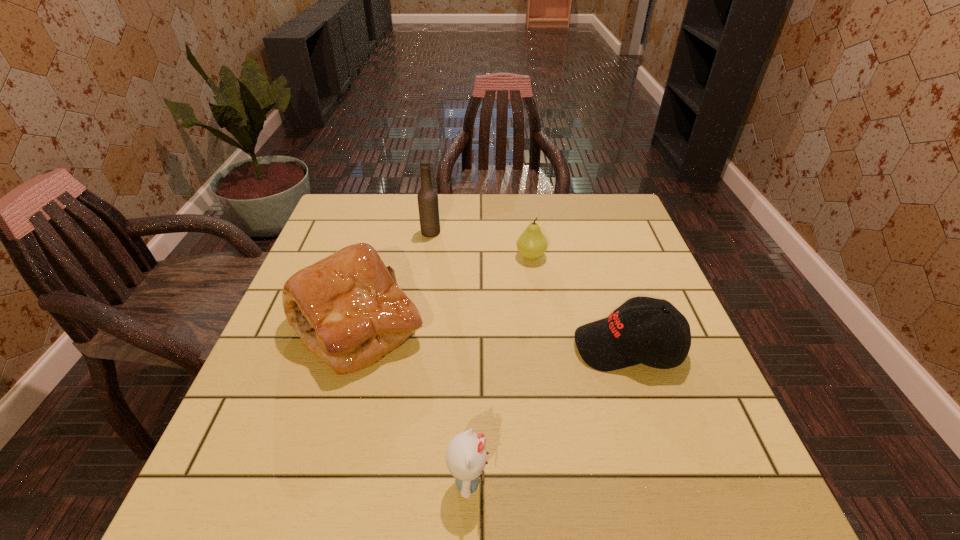
At what (x,y) coordinates should I click in order to perform the action: click on free spot between the baseball cap and the bread. Please return your answer as a coordinate pair (x, y). Image resolution: width=960 pixels, height=540 pixels. Looking at the image, I should click on (492, 336).

Where is `empty space that is in between the second object from right to left and the baseball cap`? The width and height of the screenshot is (960, 540). empty space that is in between the second object from right to left and the baseball cap is located at coordinates (580, 301).

Locate an element on the screen. vacant area that lies between the beer bottle and the third object from right to left is located at coordinates (449, 356).

You are a GUI agent. You are given a task and a screenshot of the screen. Output one action in this format:
    pyautogui.click(x=<x>, y=<y>)
    Task: Click on the free space between the fourth nearest object and the farthest object
    The image size is (960, 540).
    Given the screenshot: What is the action you would take?
    point(481,244)

Where is `empty space between the rightmost object and the tallest object`? The width and height of the screenshot is (960, 540). empty space between the rightmost object and the tallest object is located at coordinates (529, 290).

I want to click on vacant space that's between the beer bottle and the baseball cap, so click(x=529, y=290).

Identify the location of the closest object to the bread. (466, 456).

Identify which object is located as the third nearest to the fourth shortest object. Please provide its 2D coordinates. Your answer should be formatted as a tuple, i.e. [(x, y)], where the tuple contains the x and y coordinates of a point satisfying the conditions above.

[(531, 244)]

Where is `vacant region that satisfies the following two spatial constraints: 1. on the back side of the fourth object from left to right; 2. on the side of the farthest object with the label`? vacant region that satisfies the following two spatial constraints: 1. on the back side of the fourth object from left to right; 2. on the side of the farthest object with the label is located at coordinates (528, 232).

The image size is (960, 540). I want to click on free spot that satisfies the following two spatial constraints: 1. on the front side of the pear; 2. on the filling side of the fourth shortest object, so click(x=540, y=326).